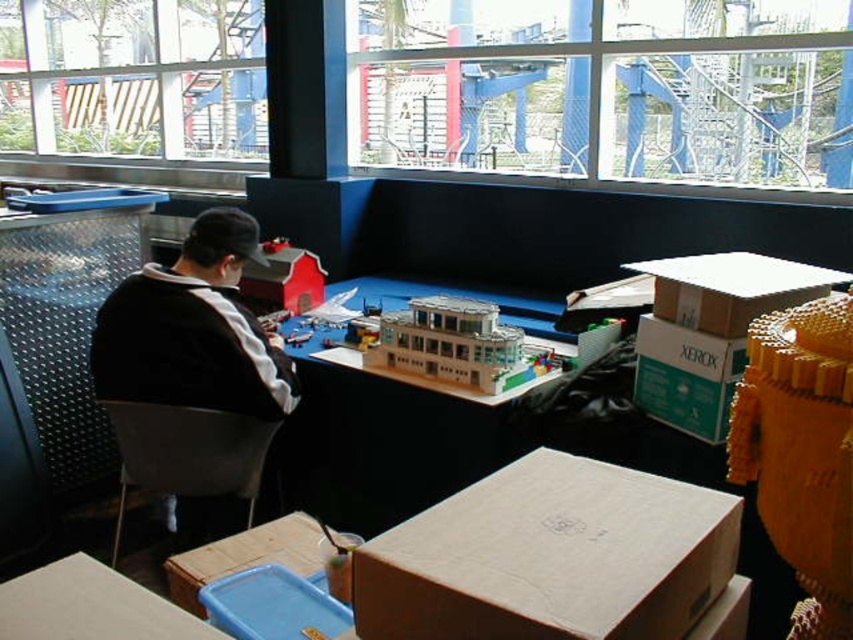
Question: Does brown cardboard box at center have a smaller size compared to clear glass window at upper center?

Choices:
 (A) yes
 (B) no

Answer: (A)

Question: Estimate the real-world distances between objects in this image. Which object is closer to the green cardboard box at center right?

Choices:
 (A) matte plastic barn at upper center
 (B) translucent plastic building at center
 (C) gray plastic chair at lower left
 (D) brown cardboard box at lower center

Answer: (B)

Question: Where is brown cardboard box at lower center located in relation to matte plastic barn at upper center in the image?

Choices:
 (A) below
 (B) above

Answer: (A)

Question: Among these objects, which one is farthest from the camera?

Choices:
 (A) black fabric jacket at left
 (B) brown cardboard box at center
 (C) clear glass window at upper center
 (D) smooth cardboard table at lower left

Answer: (C)

Question: Does white cardboard box at upper right have a smaller size compared to brown cardboard box at lower center?

Choices:
 (A) yes
 (B) no

Answer: (B)

Question: Which point is closer to the camera?

Choices:
 (A) (426, 321)
 (B) (747, 269)
 (C) (155, 442)

Answer: (B)